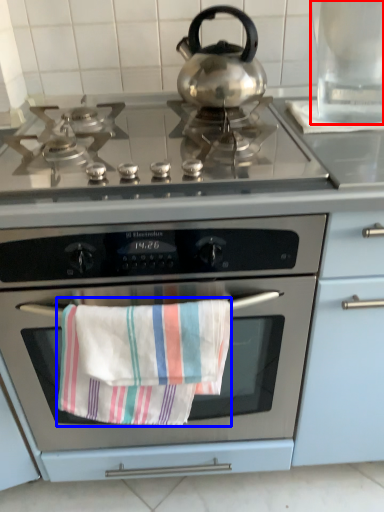
Question: Which object appears farthest to the camera in this image, appliance (highlighted by a red box) or beach towel (highlighted by a blue box)?

Choices:
 (A) appliance
 (B) beach towel

Answer: (A)